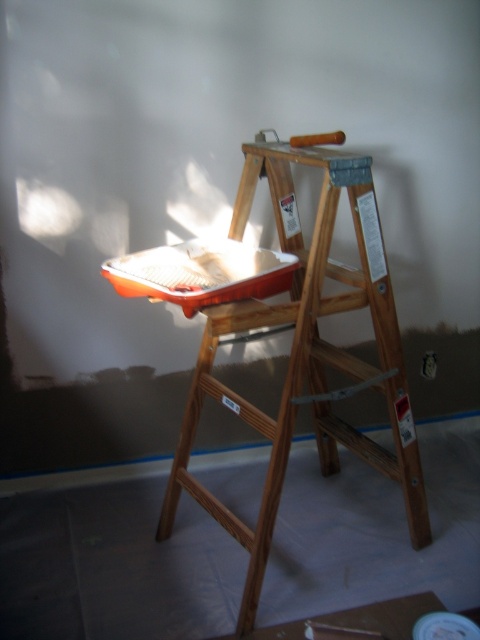
Question: From the image, what is the correct spatial relationship of wooden ladder at center in relation to metallic red tray at center?

Choices:
 (A) above
 (B) below

Answer: (B)

Question: Does wooden ladder at center have a lesser width compared to metallic red tray at center?

Choices:
 (A) yes
 (B) no

Answer: (B)

Question: Which point is closer to the camera taking this photo?

Choices:
 (A) 268,506
 (B) 197,276

Answer: (A)

Question: Which point is closer to the camera taking this photo?

Choices:
 (A) (277, 278)
 (B) (267, 550)

Answer: (B)

Question: Is wooden ladder at center below metallic red tray at center?

Choices:
 (A) no
 (B) yes

Answer: (B)